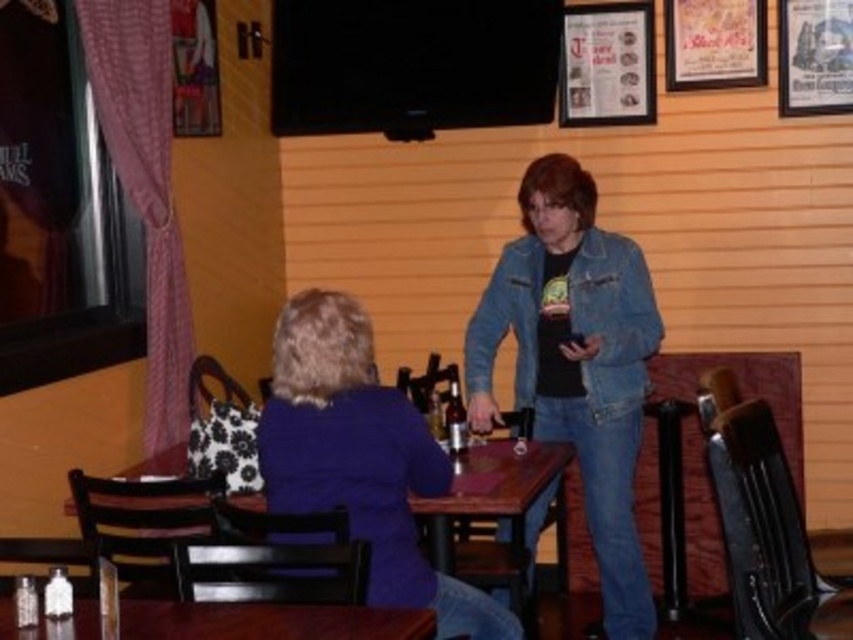
Can you confirm if denim jacket at center is bigger than wooden table at center?

Yes, denim jacket at center is bigger than wooden table at center.

Does point (521, 356) lie behind point (498, 481)?

Yes, point (521, 356) is behind point (498, 481).

At what (x,y) coordinates should I click in order to perform the action: click on denim jacket at center. Please return your answer as a coordinate pair (x, y). The height and width of the screenshot is (640, 853). Looking at the image, I should click on (576, 362).

What do you see at coordinates (361, 458) in the screenshot? The image size is (853, 640). I see `purple matte jacket at center` at bounding box center [361, 458].

Between purple matte jacket at center and wooden table at lower left, which one has more height?

Standing taller between the two is purple matte jacket at center.

Between point (316, 294) and point (96, 618), which one is positioned in front?

Point (96, 618)

Find the location of a particular element. purple matte jacket at center is located at coordinates (361, 458).

Can you confirm if denim jacket at center is positioned above purple matte jacket at center?

Correct, denim jacket at center is located above purple matte jacket at center.

Can you confirm if denim jacket at center is wider than purple matte jacket at center?

No, denim jacket at center is not wider than purple matte jacket at center.

Which is in front, point (546, 268) or point (293, 448)?

Point (293, 448) is more forward.

Locate an element on the screen. denim jacket at center is located at coordinates (576, 362).